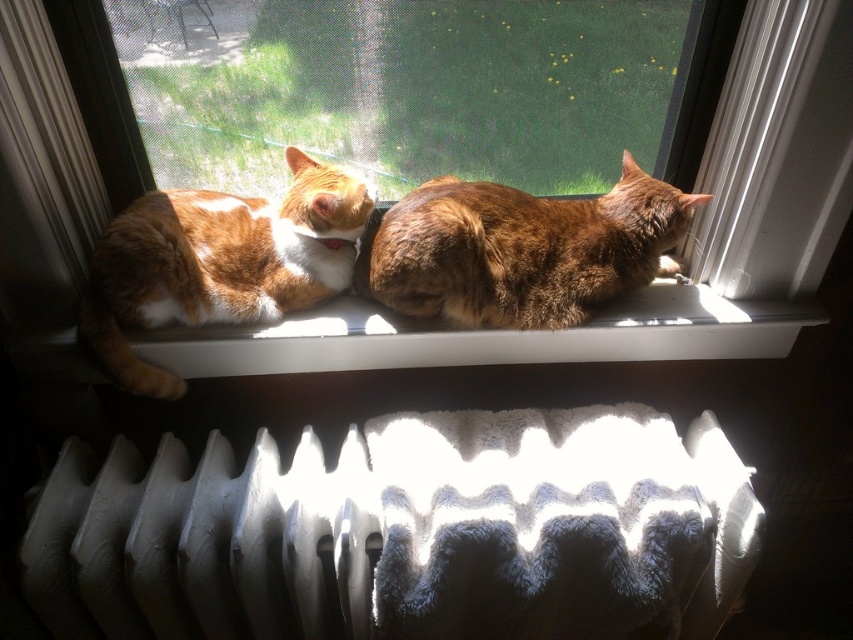
Is the position of clear glass window at center less distant than that of orange fur cat at center?

Yes, clear glass window at center is closer to the viewer.

Is clear glass window at center smaller than orange fur cat at center?

Incorrect, clear glass window at center is not smaller in size than orange fur cat at center.

The image size is (853, 640). What do you see at coordinates (685, 244) in the screenshot?
I see `clear glass window at center` at bounding box center [685, 244].

At what (x,y) coordinates should I click in order to perform the action: click on clear glass window at center. Please return your answer as a coordinate pair (x, y). Image resolution: width=853 pixels, height=640 pixels. Looking at the image, I should click on (685, 244).

Does white textured radiator at lower center have a lesser height compared to clear glass window at center?

Yes.

Which is more to the left, white textured radiator at lower center or clear glass window at center?

white textured radiator at lower center is more to the left.

You are a GUI agent. You are given a task and a screenshot of the screen. Output one action in this format:
    pyautogui.click(x=<x>, y=<y>)
    Task: Click on the white textured radiator at lower center
    Image resolution: width=853 pixels, height=640 pixels.
    Given the screenshot: What is the action you would take?
    pyautogui.click(x=404, y=532)

Who is more distant from viewer, (71, 259) or (155, 534)?

Positioned behind is point (71, 259).

Is the position of clear glass window at center more distant than that of white textured radiator at lower left?

No, it is not.

The image size is (853, 640). In order to click on clear glass window at center in this screenshot , I will do `click(685, 244)`.

Identify the location of clear glass window at center. This screenshot has width=853, height=640. (685, 244).